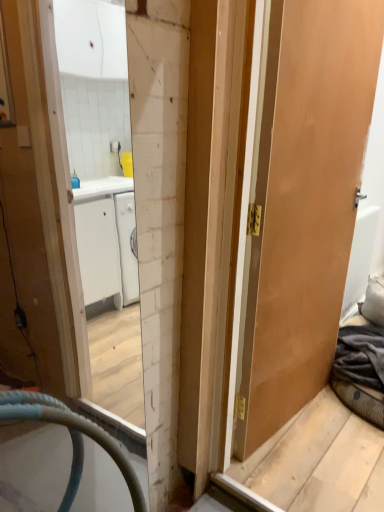
Question: Does white textured radiator at right appear on the right side of matte wooden door at right?

Choices:
 (A) no
 (B) yes

Answer: (B)

Question: From the image's perspective, is white textured radiator at right above matte wooden door at right?

Choices:
 (A) no
 (B) yes

Answer: (A)

Question: From a real-world perspective, does white textured radiator at right sit lower than matte wooden door at right?

Choices:
 (A) yes
 (B) no

Answer: (A)

Question: From the image's perspective, is white textured radiator at right beneath matte wooden door at right?

Choices:
 (A) no
 (B) yes

Answer: (B)

Question: Is white textured radiator at right facing away from matte wooden door at right?

Choices:
 (A) no
 (B) yes

Answer: (A)

Question: Can you confirm if white textured radiator at right is shorter than matte wooden door at right?

Choices:
 (A) yes
 (B) no

Answer: (A)

Question: Can you confirm if matte wooden door at right is shorter than white textured radiator at right?

Choices:
 (A) yes
 (B) no

Answer: (B)

Question: Does matte wooden door at right have a larger size compared to white textured radiator at right?

Choices:
 (A) no
 (B) yes

Answer: (B)

Question: Is matte wooden door at right facing towards white textured radiator at right?

Choices:
 (A) yes
 (B) no

Answer: (B)

Question: From the image's perspective, does matte wooden door at right appear lower than white textured radiator at right?

Choices:
 (A) no
 (B) yes

Answer: (A)

Question: Does matte wooden door at right have a smaller size compared to white textured radiator at right?

Choices:
 (A) yes
 (B) no

Answer: (B)

Question: Is matte wooden door at right at the left side of white textured radiator at right?

Choices:
 (A) yes
 (B) no

Answer: (A)

Question: Is white textured radiator at right bigger or smaller than matte wooden door at right?

Choices:
 (A) small
 (B) big

Answer: (A)